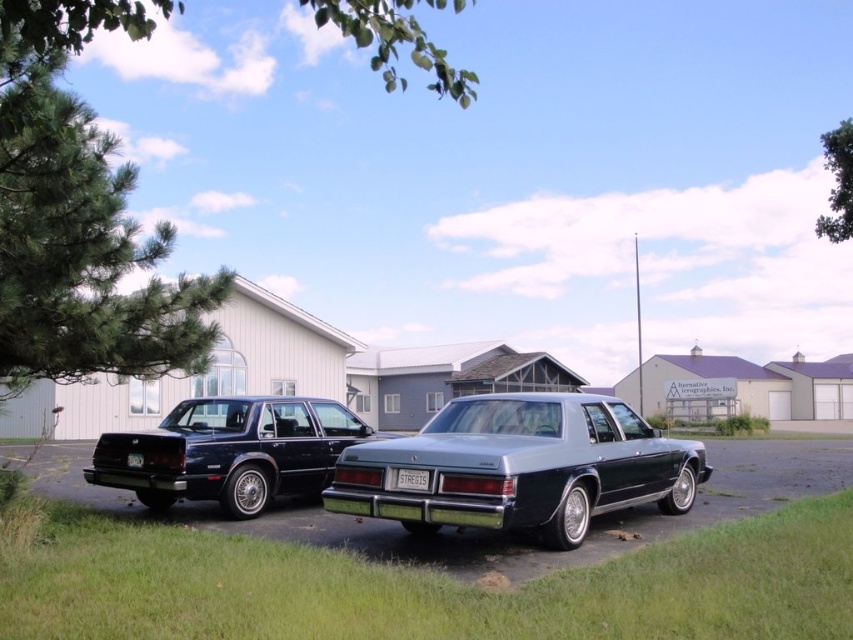
Between satin silver sedan at center and metallic blue car at center, which one is positioned lower?

metallic blue car at center

Can you confirm if satin silver sedan at center is shorter than metallic blue car at center?

Indeed, satin silver sedan at center has a lesser height compared to metallic blue car at center.

Does point (549, 408) come farther from viewer compared to point (788, 454)?

No, it is not.

Image resolution: width=853 pixels, height=640 pixels. Identify the location of satin silver sedan at center. (520, 467).

Is satin silver sedan at center wider than white plastic license plate at center?

In fact, satin silver sedan at center might be narrower than white plastic license plate at center.

Based on the photo, is satin silver sedan at center to the right of white plastic license plate at center from the viewer's perspective?

Indeed, satin silver sedan at center is positioned on the right side of white plastic license plate at center.

Locate an element on the screen. This screenshot has width=853, height=640. satin silver sedan at center is located at coordinates (520, 467).

Does satin silver sedan at center have a lesser height compared to glossy black sedan at left?

Indeed, satin silver sedan at center has a lesser height compared to glossy black sedan at left.

At what (x,y) coordinates should I click in order to perform the action: click on satin silver sedan at center. Please return your answer as a coordinate pair (x, y). Looking at the image, I should click on (520, 467).

Where is `satin silver sedan at center`? The width and height of the screenshot is (853, 640). satin silver sedan at center is located at coordinates (520, 467).